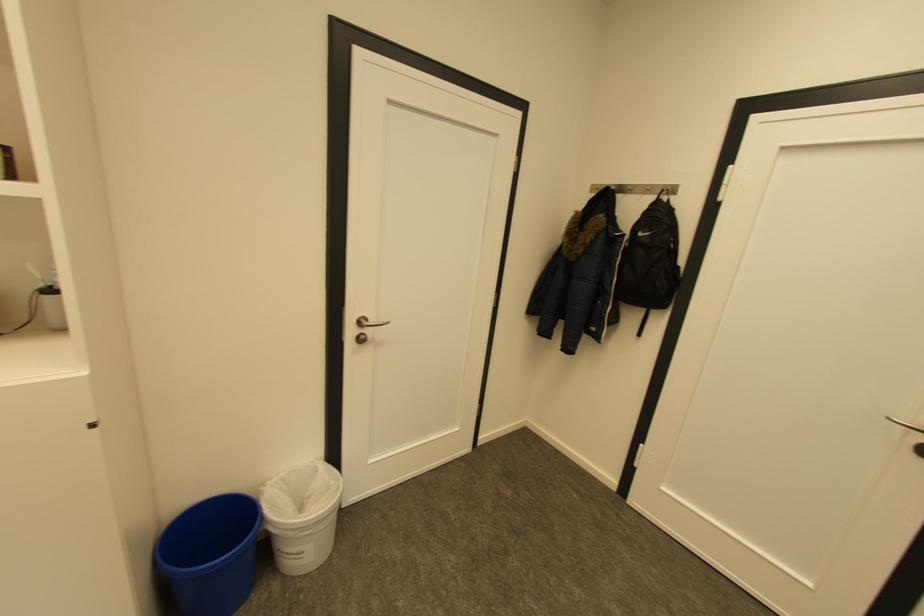
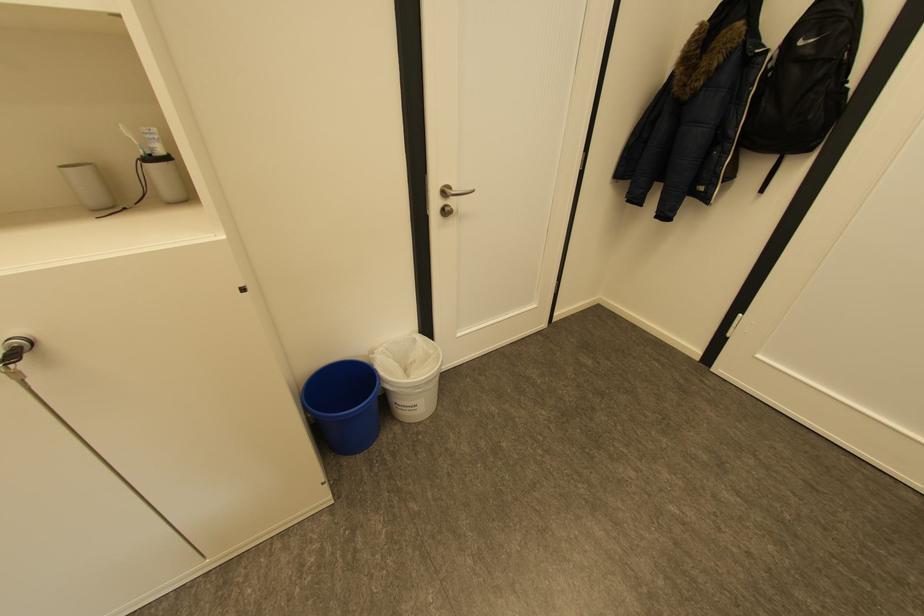
Where in the second image is the point corresponding to (367,323) from the first image?

(451, 192)